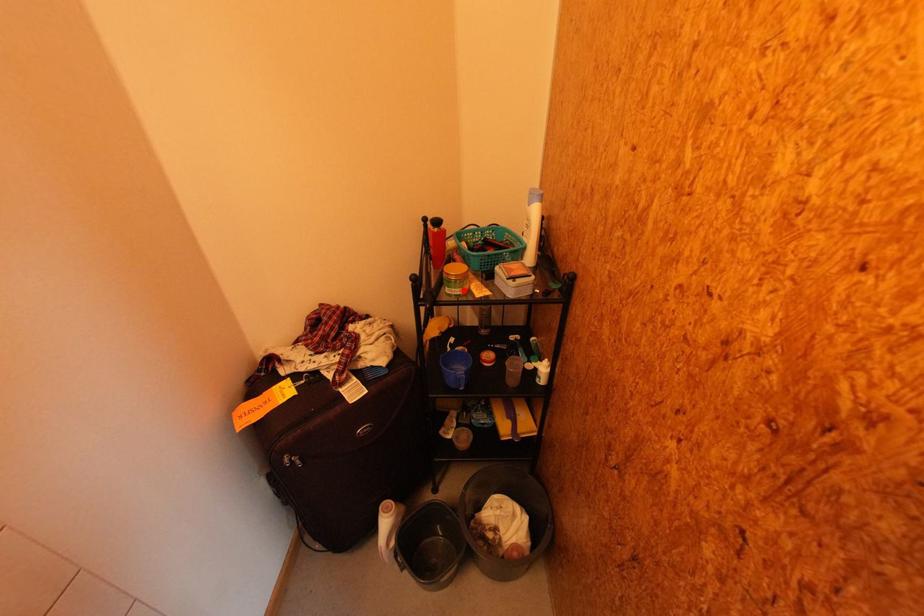
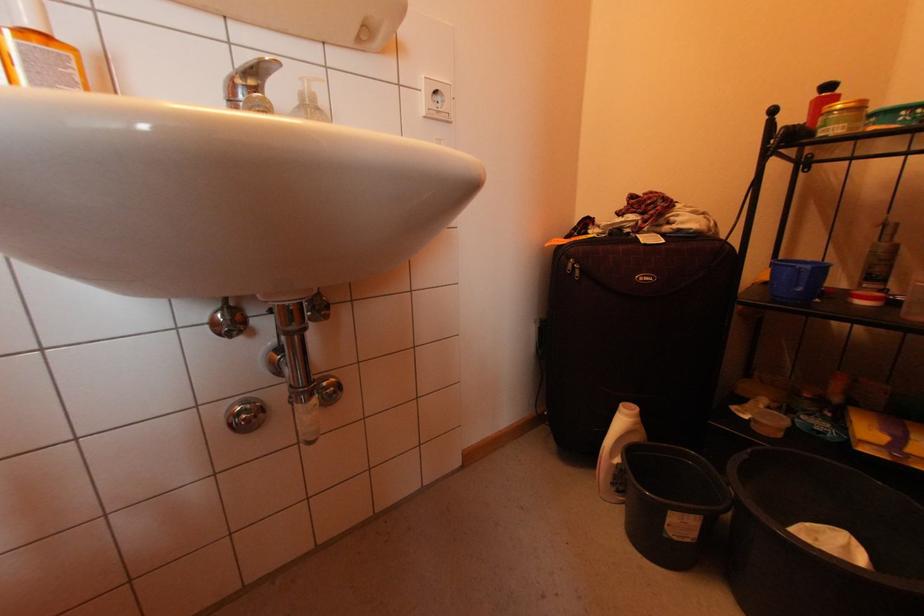
The point at the highlighted location is marked in the first image. Where is the corresponding point in the second image?

(845, 126)